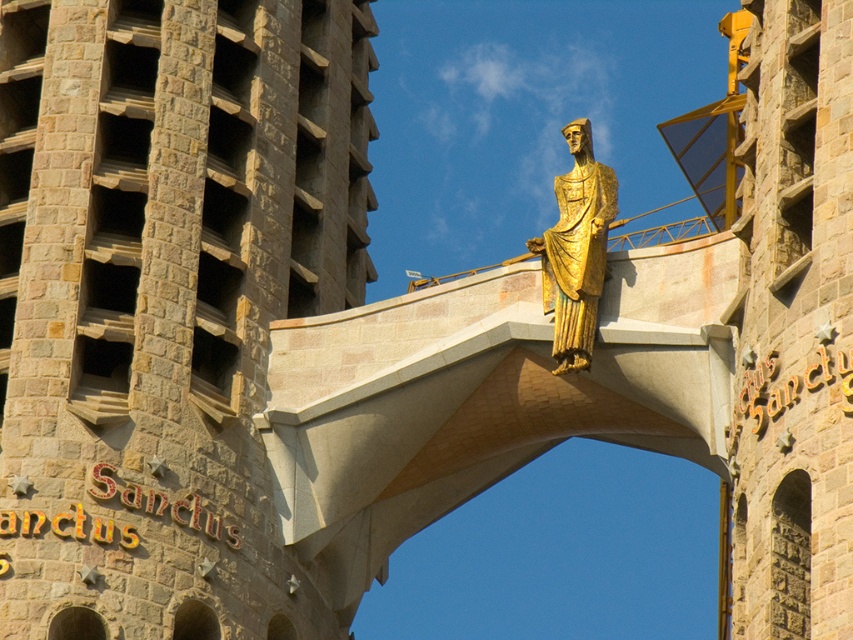
You are an architect analyzing the Sagrada Familia. You observe the beige stone tower at center and the gold polished statue at upper center. Which object has a greater width?

The beige stone tower at center might be wider than gold polished statue at upper center according to the description.

You are an architect analyzing the Sagrada Familia. You observe the beige stone tower at center and the gold polished statue at upper center. Which object takes up more area in the image?

The gold polished statue at upper center occupies more space than the beige stone tower at center according to the description.